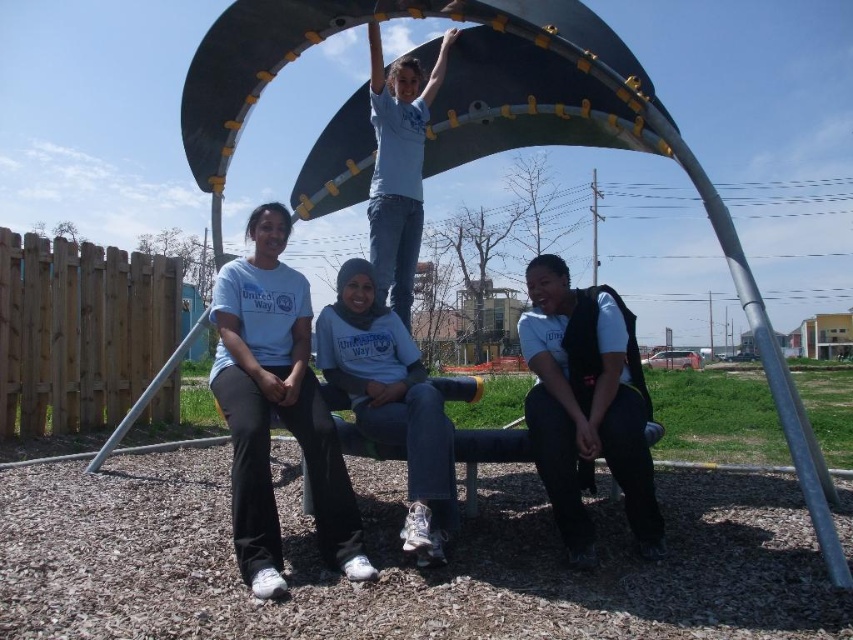
Question: Among these points, which one is farthest from the camera?

Choices:
 (A) (235, 282)
 (B) (381, 259)

Answer: (B)

Question: Which object is closer to the camera taking this photo?

Choices:
 (A) black matte vest at lower right
 (B) gray matte hoodie at center
 (C) white matte pants at lower left

Answer: (C)

Question: Is white matte pants at lower left to the right of gray matte hoodie at center from the viewer's perspective?

Choices:
 (A) yes
 (B) no

Answer: (B)

Question: Can you confirm if white matte pants at lower left is wider than white matte shirt at upper center?

Choices:
 (A) yes
 (B) no

Answer: (A)

Question: Is gray matte hoodie at center wider than white matte shirt at upper center?

Choices:
 (A) yes
 (B) no

Answer: (A)

Question: Which of the following is the farthest from the observer?

Choices:
 (A) (413, 515)
 (B) (386, 156)

Answer: (B)